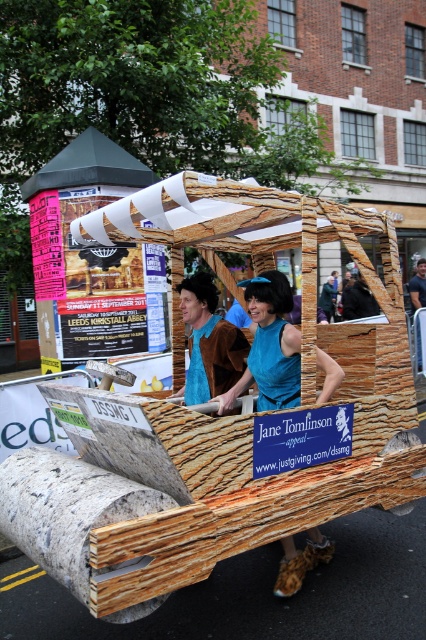
You are a participant in the parade and need to access the brown leather jacket at center. Is the wooden cart at center blocking your path to it?

The wooden cart at center is positioned under brown leather jacket at center, so the wooden cart at center is blocking the path to the brown leather jacket at center.

You are a photographer positioned at the back of the street. You want to capture a photo of the teal fabric dress at center and the wooden cart at center in the same frame. Considering their widths, which object should you focus on to ensure both fit in the frame?

The wooden cart at center is wider than the teal fabric dress at center. To ensure both fit in the frame, focus on the wooden cart at center as it requires more space, and adjust the camera angle to include the teal fabric dress at center alongside it.

You are a photographer at the parade and need to capture both the teal fabric dress at center and the blue fabric at center in a single shot. Which one should you focus on first to ensure both are in frame?

The teal fabric dress at center is taller than the blue fabric at center, so focus on the taller teal fabric dress at center first to ensure the blue fabric at center is also captured in the frame.